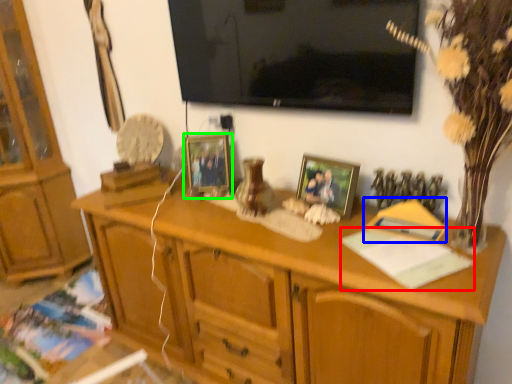
Question: Which object is the closest to the book (highlighted by a red box)? Choose among these: book (highlighted by a blue box) or picture frame (highlighted by a green box).

Choices:
 (A) book
 (B) picture frame

Answer: (A)